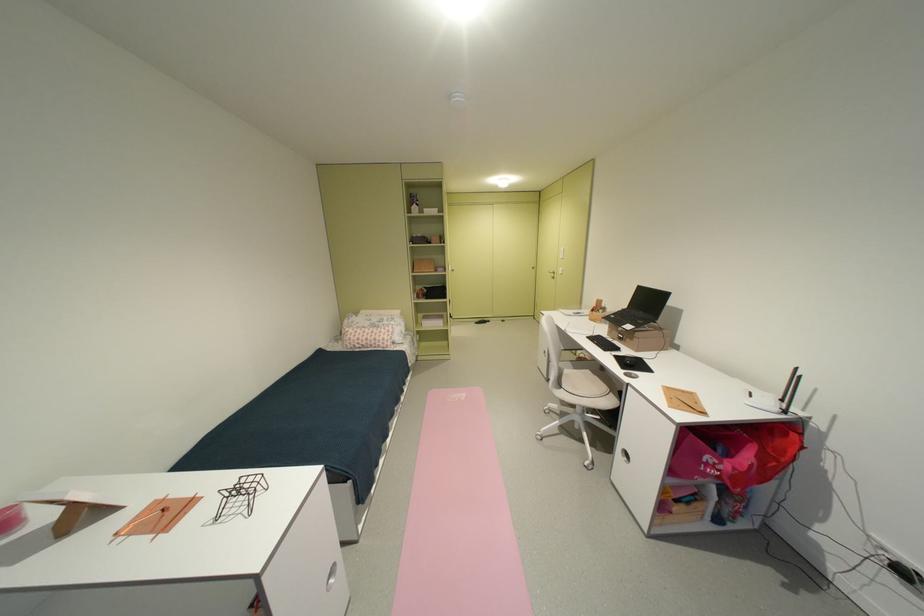
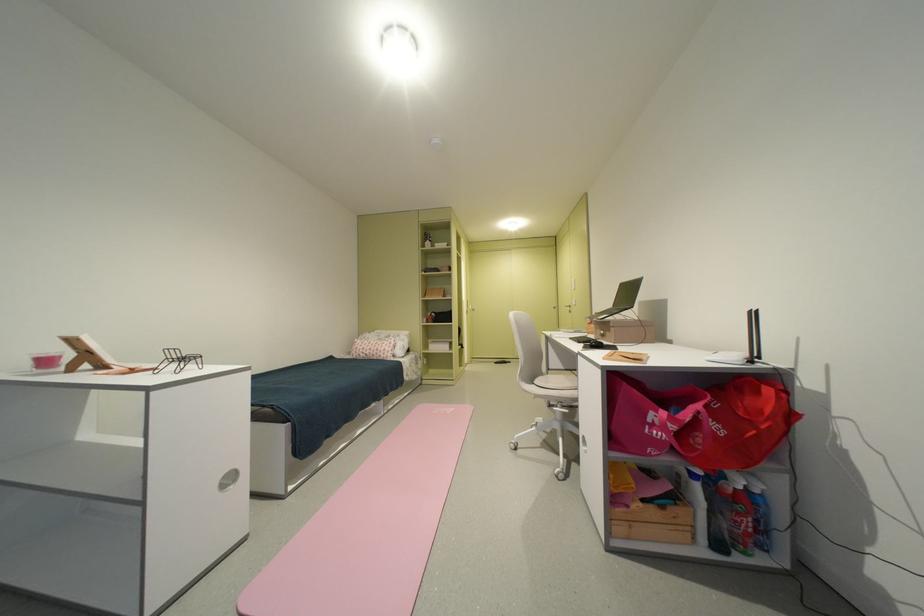
Question: Which direction would the cameraman need to move to produce the second image? Reply with the corresponding letter.

Choices:
 (A) Left
 (B) Right
 (C) Forward
 (D) Backward

Answer: (B)